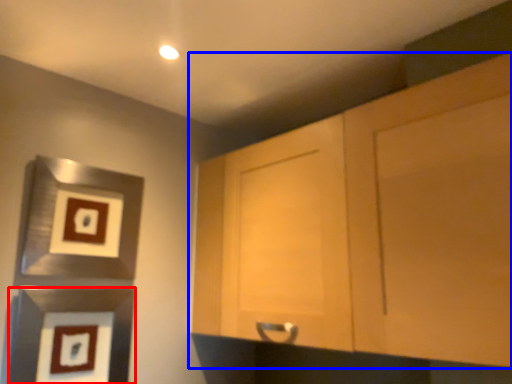
Question: Which object appears closest to the camera in this image, picture frame (highlighted by a red box) or cabinetry (highlighted by a blue box)?

Choices:
 (A) picture frame
 (B) cabinetry

Answer: (B)